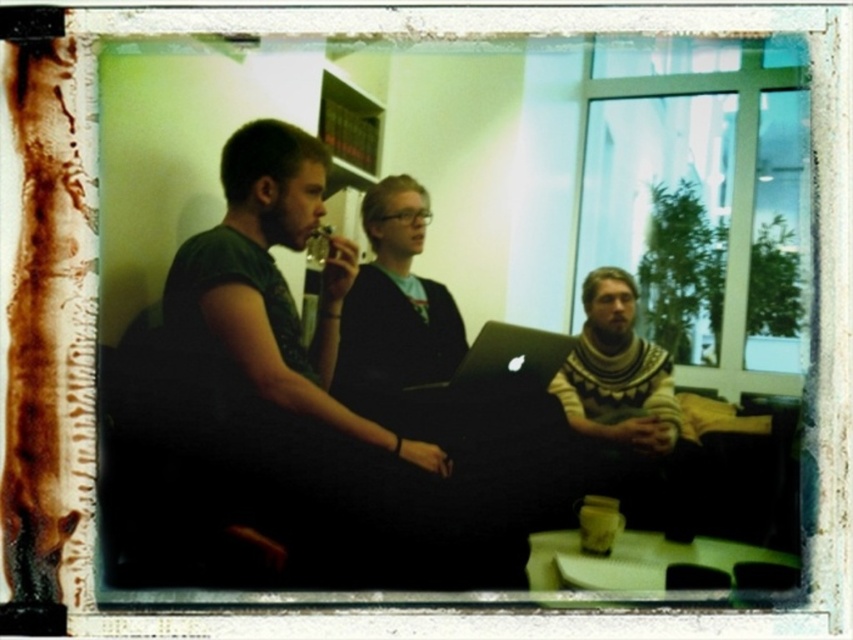
You are a photographer trying to capture a candid shot of the scene. You want to ensure that both the matte black sweater at center and the black matte laptop at center are clearly visible in the frame. Given their relative heights, which object should you focus on first to ensure proper depth of field?

The matte black sweater at center is taller than the black matte laptop at center, so focusing on the taller object first will help ensure both are in focus due to the depth of field extending from the point of focus.

You are a photographer trying to capture a candid shot of the two people at the center of the image. Since the green matte shirt at center and the knitted sweater at center are both in the frame, which one is covering the other?

The green matte shirt at center is positioned over the knitted sweater at center, so the green matte shirt at center is covering the knitted sweater at center.